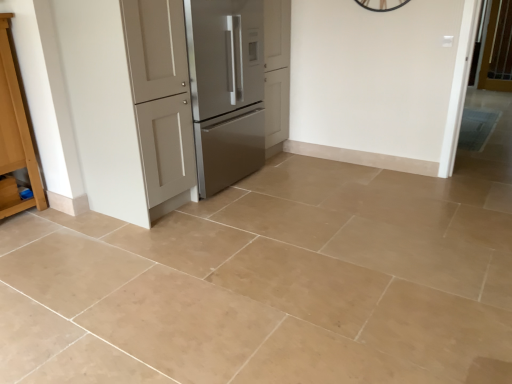
Question: Is the depth of light brown wood cabinet at left greater than that of clear glass screen door at upper right?

Choices:
 (A) yes
 (B) no

Answer: (B)

Question: Does light brown wood cabinet at left have a greater width compared to clear glass screen door at upper right?

Choices:
 (A) no
 (B) yes

Answer: (B)

Question: Is light brown wood cabinet at left next to clear glass screen door at upper right?

Choices:
 (A) yes
 (B) no

Answer: (B)

Question: Is light brown wood cabinet at left to the left of clear glass screen door at upper right from the viewer's perspective?

Choices:
 (A) yes
 (B) no

Answer: (A)

Question: Is light brown wood cabinet at left facing towards clear glass screen door at upper right?

Choices:
 (A) yes
 (B) no

Answer: (B)

Question: From the image's perspective, relative to clear glass screen door at upper right, is matte white door at center above or below?

Choices:
 (A) below
 (B) above

Answer: (A)

Question: Based on their positions, is matte white door at center located to the left or right of clear glass screen door at upper right?

Choices:
 (A) left
 (B) right

Answer: (A)

Question: Based on their sizes in the image, would you say matte white door at center is bigger or smaller than clear glass screen door at upper right?

Choices:
 (A) small
 (B) big

Answer: (B)

Question: From a real-world perspective, is matte white door at center above or below clear glass screen door at upper right?

Choices:
 (A) below
 (B) above

Answer: (A)

Question: Based on their sizes in the image, would you say clear glass screen door at upper right is bigger or smaller than light brown wood cabinet at left?

Choices:
 (A) big
 (B) small

Answer: (B)

Question: Is clear glass screen door at upper right taller or shorter than light brown wood cabinet at left?

Choices:
 (A) short
 (B) tall

Answer: (A)

Question: Relative to light brown wood cabinet at left, is clear glass screen door at upper right in front or behind?

Choices:
 (A) front
 (B) behind

Answer: (B)

Question: Is clear glass screen door at upper right spatially inside light brown wood cabinet at left, or outside of it?

Choices:
 (A) inside
 (B) outside

Answer: (B)

Question: In the image, is satin silver refrigerator at center-left positioned in front of or behind light brown wood cabinet at left?

Choices:
 (A) front
 (B) behind

Answer: (B)

Question: From the image's perspective, is satin silver refrigerator at center-left above or below light brown wood cabinet at left?

Choices:
 (A) above
 (B) below

Answer: (A)